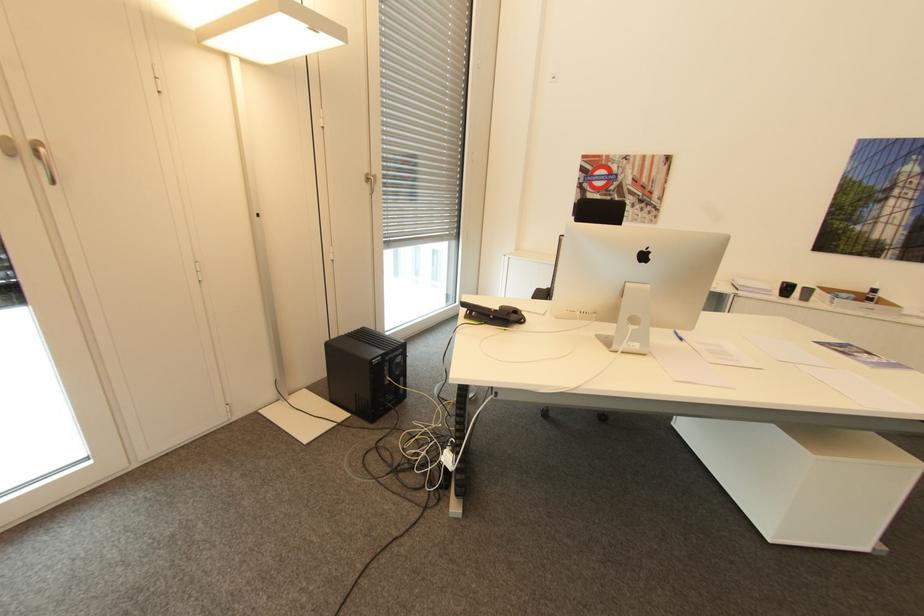
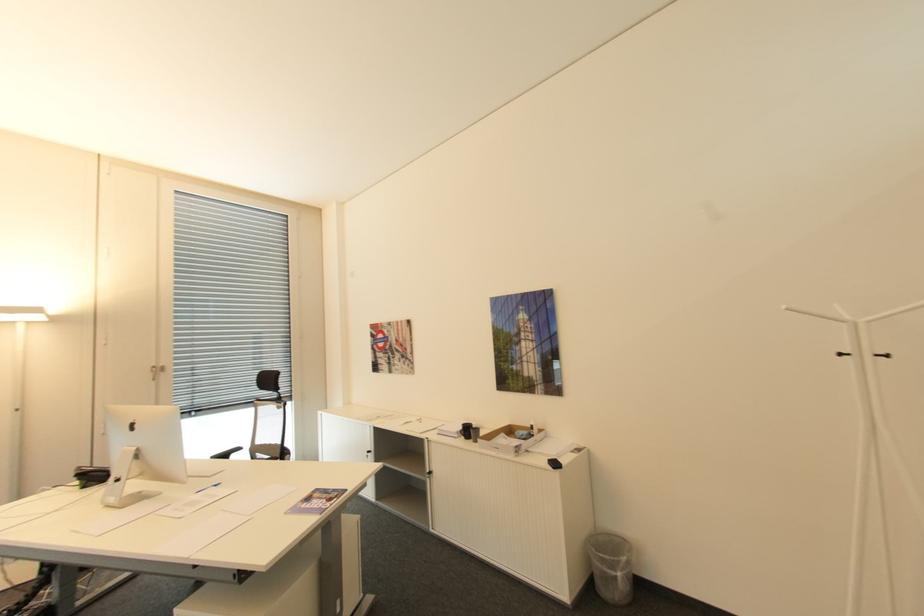
Find the pixel in the second image that matches [788,283] in the first image.

(468, 424)